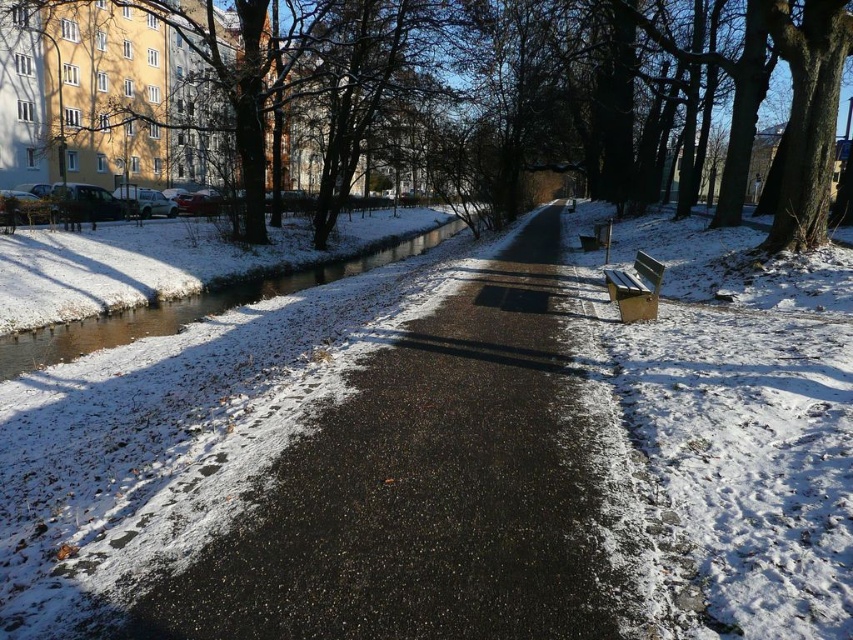
Question: Estimate the real-world distances between objects in this image. Which object is closer to the brown/ice waterway at center-left?

Choices:
 (A) wooden bench at right
 (B) black asphalt path at center

Answer: (B)

Question: Observing the image, what is the correct spatial positioning of brown/ice waterway at center-left in reference to wooden bench at right?

Choices:
 (A) above
 (B) below

Answer: (A)

Question: Is black asphalt path at center bigger than brown/ice waterway at center-left?

Choices:
 (A) no
 (B) yes

Answer: (A)

Question: Which point is closer to the camera?

Choices:
 (A) brown/ice waterway at center-left
 (B) black asphalt path at center
 (C) brown textured tree at center

Answer: (B)

Question: Is brown/ice waterway at center-left to the left of wooden bench at right from the viewer's perspective?

Choices:
 (A) no
 (B) yes

Answer: (B)

Question: Which point is closer to the camera?

Choices:
 (A) brown textured tree at center
 (B) wooden bench at right
 (C) brown/ice waterway at center-left
 (D) black asphalt path at center

Answer: (D)